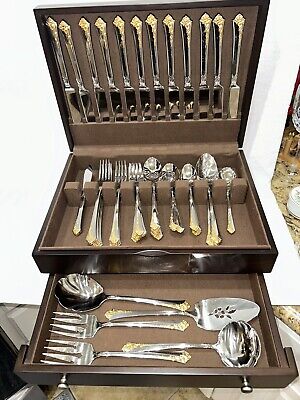
At what (x,y) coordinates should I click in order to perform the action: click on spoon handle. Please return your answer as a coordinate pair (x, y). Image resolution: width=300 pixels, height=400 pixels. Looking at the image, I should click on (180, 345), (149, 301), (153, 311), (231, 212), (211, 214), (194, 210), (174, 212), (152, 210).